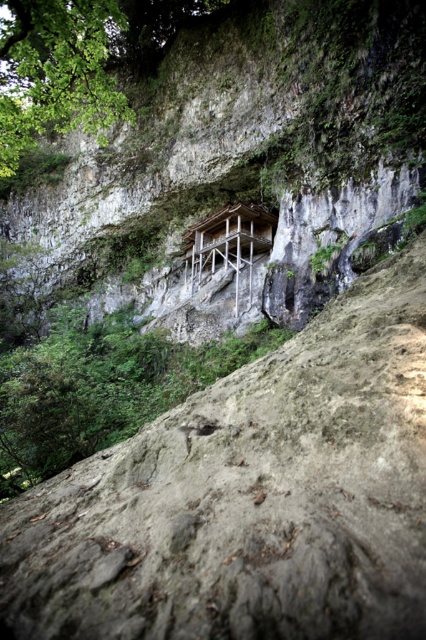
Between point (6, 68) and point (253, 218), which one is positioned behind?

The point (6, 68) is behind.

Looking at this image, is green leafy tree at upper left thinner than wooden platform at center?

No, green leafy tree at upper left is not thinner than wooden platform at center.

Is point (25, 45) less distant than point (239, 259)?

Yes.

Identify the location of green leafy tree at upper left. The width and height of the screenshot is (426, 640). (54, 72).